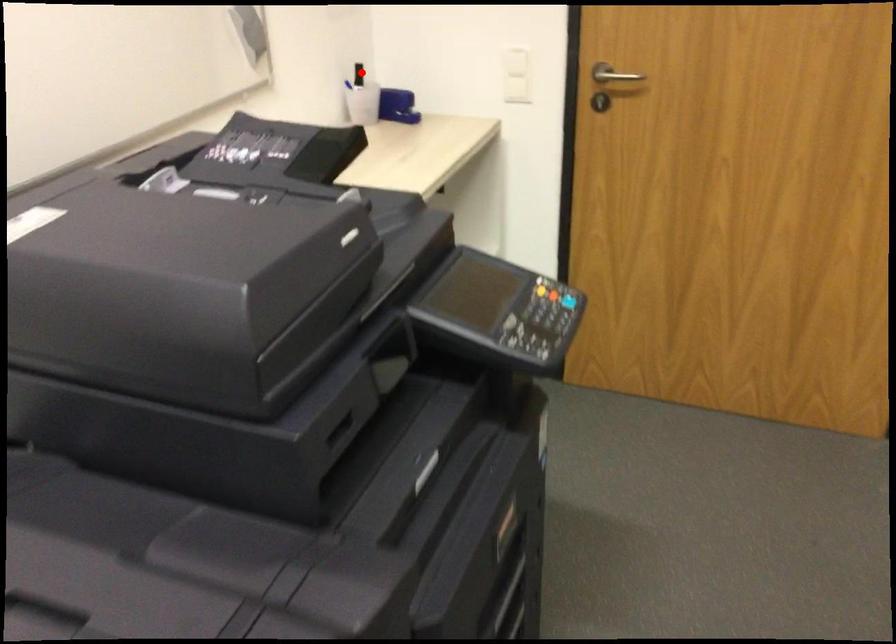
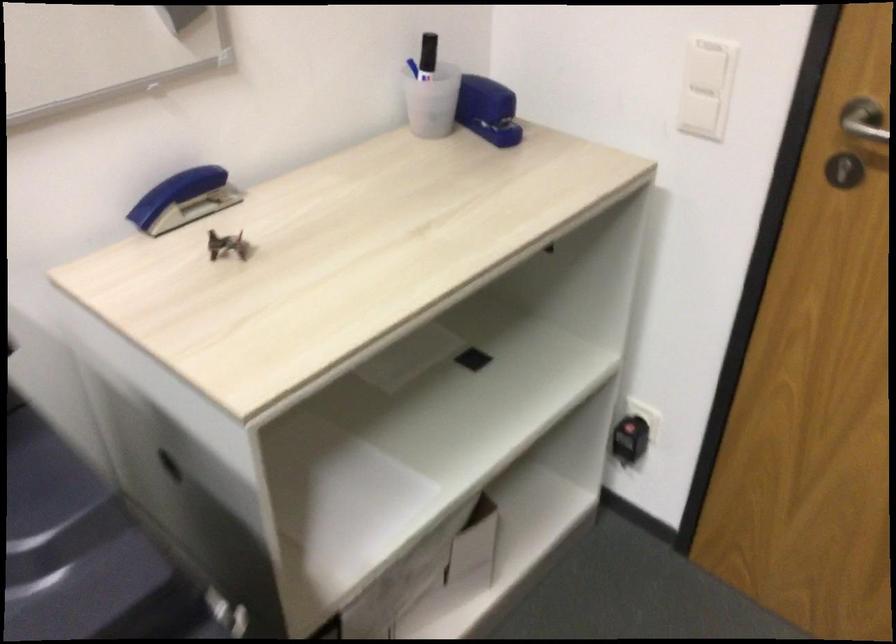
In the second image, find the point that corresponds to the highlighted location in the first image.

(428, 55)